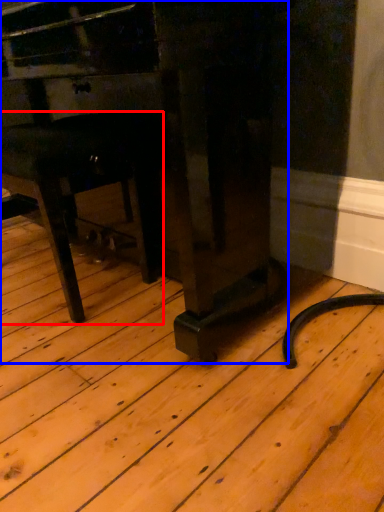
Question: Which of the following is the closest to the observer, furniture (highlighted by a red box) or furniture (highlighted by a blue box)?

Choices:
 (A) furniture
 (B) furniture

Answer: (B)